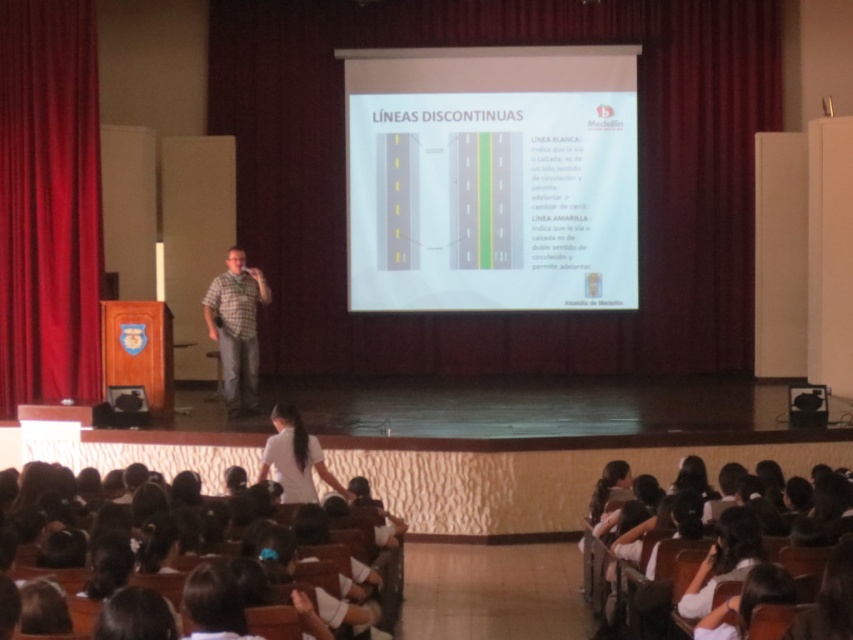
Question: Which point is closer to the camera taking this photo?

Choices:
 (A) (292, 468)
 (B) (714, 547)
 (C) (235, 365)

Answer: (B)

Question: Which point is closer to the camera taking this photo?

Choices:
 (A) (28, 365)
 (B) (276, 426)
 (C) (213, 337)
 (D) (148, 532)

Answer: (D)

Question: Can you confirm if velvet red curtain at left is positioned to the left of white uniform at lower center?

Choices:
 (A) yes
 (B) no

Answer: (A)

Question: Does white paper at center appear on the right side of velvet red curtain at left?

Choices:
 (A) yes
 (B) no

Answer: (A)

Question: Is white paper at center smaller than plaid shirt at center?

Choices:
 (A) yes
 (B) no

Answer: (A)

Question: Which object appears farthest from the camera in this image?

Choices:
 (A) white uniform at lower center
 (B) white uniform shirt at lower center
 (C) plaid shirt at center
 (D) white paper at center

Answer: (D)